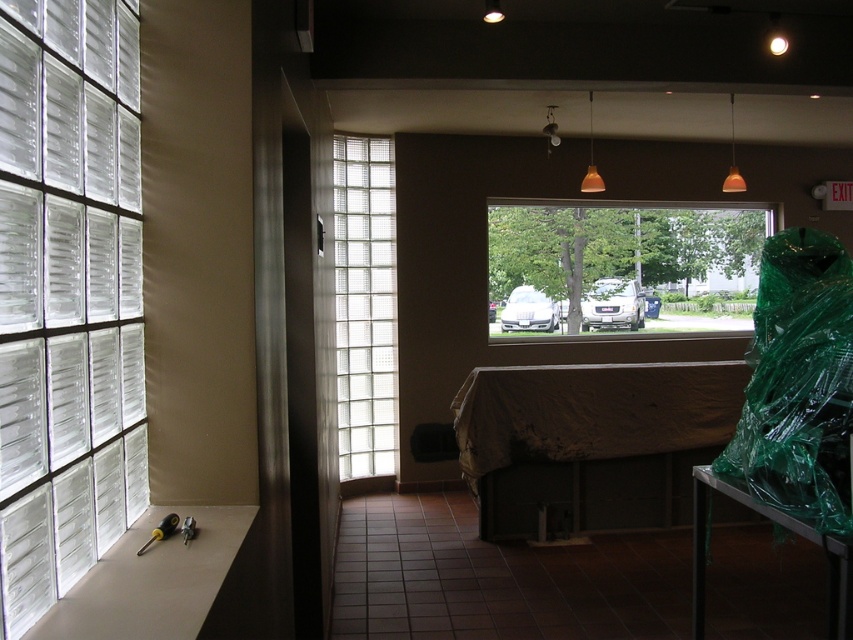
You are a construction worker who needs to place a heavy tool on a surface. You have the clear glass blocks at left and the green plastic bag at right available. Which surface can safely support the weight of the tool?

The clear glass blocks at left is positioned over green plastic bag at right, so the clear glass blocks at left can safely support the weight of the tool as they are more sturdy compared to the green plastic bag at right.